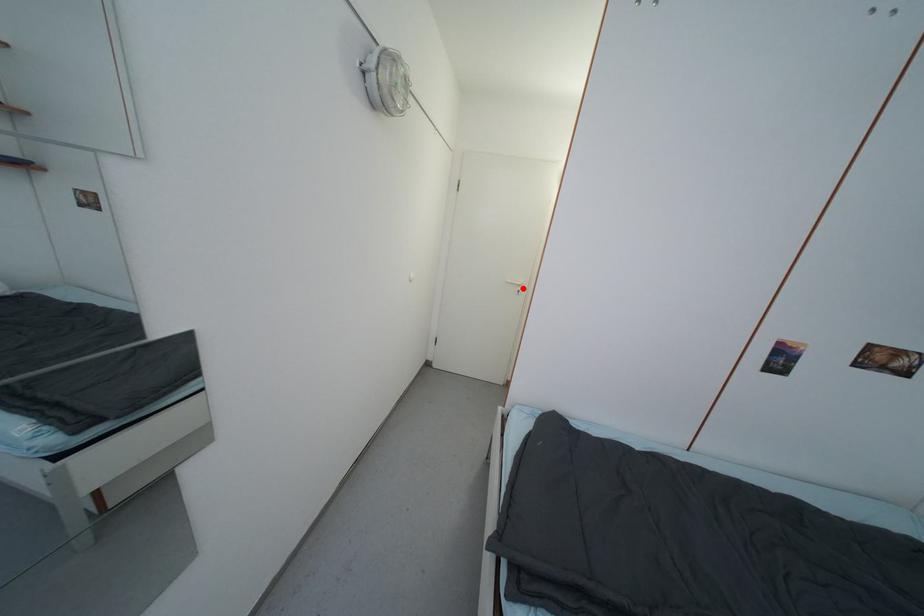
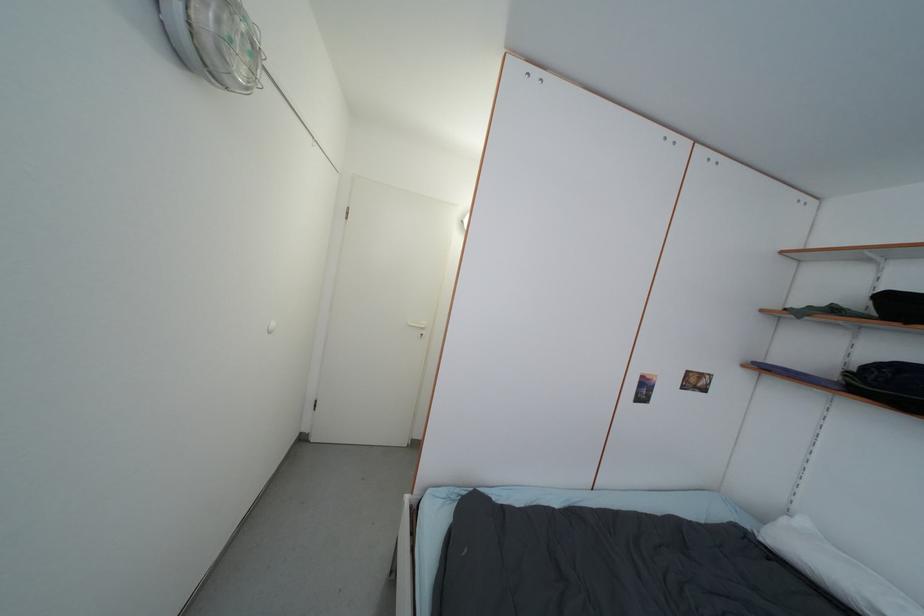
Find the pixel in the second image that matches the highlighted location in the first image.

(427, 331)